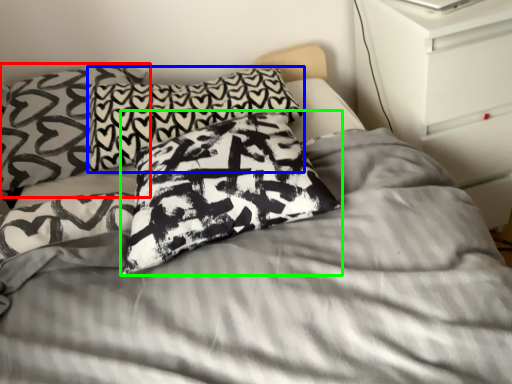
Question: Based on their relative distances, which object is farther from pillow (highlighted by a red box)? Choose from pillow (highlighted by a blue box) and pillow (highlighted by a green box).

Choices:
 (A) pillow
 (B) pillow

Answer: (B)